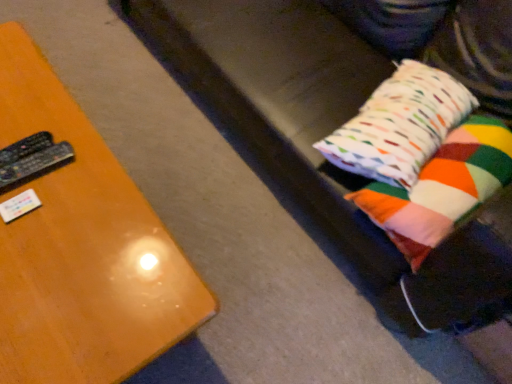
In order to click on spots to the right of black plastic remote at left, placed as the second remote when sorted from top to bottom in this screenshot , I will do (x=84, y=193).